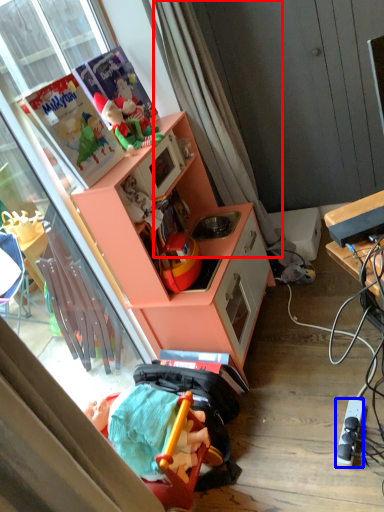
Question: Which object is further to the camera taking this photo, curtain (highlighted by a red box) or power outlet (highlighted by a blue box)?

Choices:
 (A) curtain
 (B) power outlet

Answer: (A)